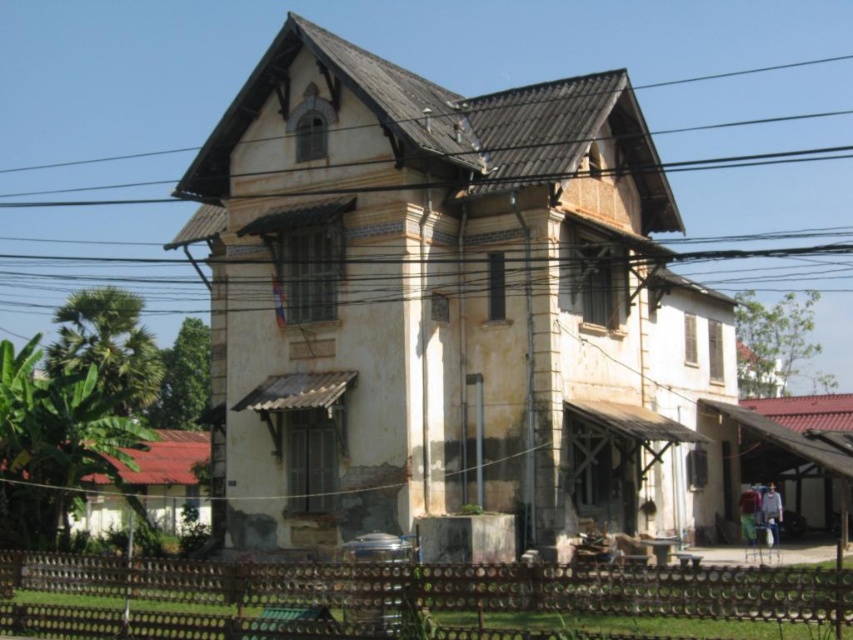
You are standing in front of the two story building and want to walk towards the brown wooden fence at lower center and the brown wire at upper center. Which object will you reach first?

The brown wooden fence at lower center is closer to the viewer than the brown wire at upper center, so you will reach the brown wooden fence at lower center first.

You are a painter hired to restore the building. You need to assess the structural integrity of the brown wooden fence at lower center and the brown wire at upper center. Which one is more likely to be structurally sound based on their thickness?

The brown wooden fence at lower center is thinner than the brown wire at upper center, so the brown wire at upper center is more likely to be structurally sound due to its greater thickness.